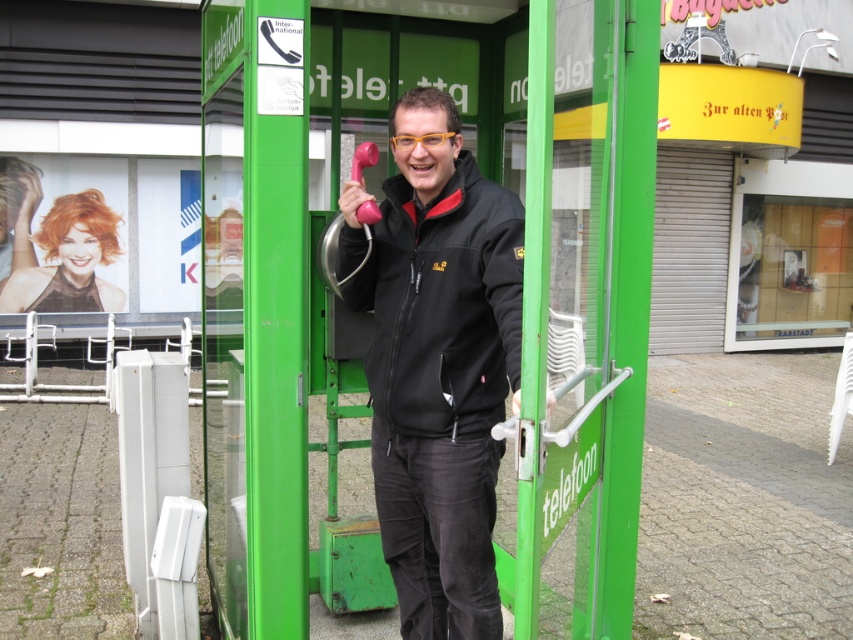
Question: Based on their relative distances, which object is farther from the black matte jacket at center?

Choices:
 (A) black softshell jacket at center
 (B) green plastic telephone booth at center

Answer: (B)

Question: Which point appears farthest from the camera in this image?

Choices:
 (A) (440, 141)
 (B) (614, 120)

Answer: (B)

Question: Among these points, which one is nearest to the camera?

Choices:
 (A) (450, 433)
 (B) (209, 99)

Answer: (A)

Question: Considering the relative positions of green plastic telephone booth at center and black matte jacket at center in the image provided, where is green plastic telephone booth at center located with respect to black matte jacket at center?

Choices:
 (A) left
 (B) right

Answer: (A)

Question: Is green plastic telephone booth at center wider than black softshell jacket at center?

Choices:
 (A) yes
 (B) no

Answer: (A)

Question: Is black matte jacket at center positioned before black softshell jacket at center?

Choices:
 (A) no
 (B) yes

Answer: (B)